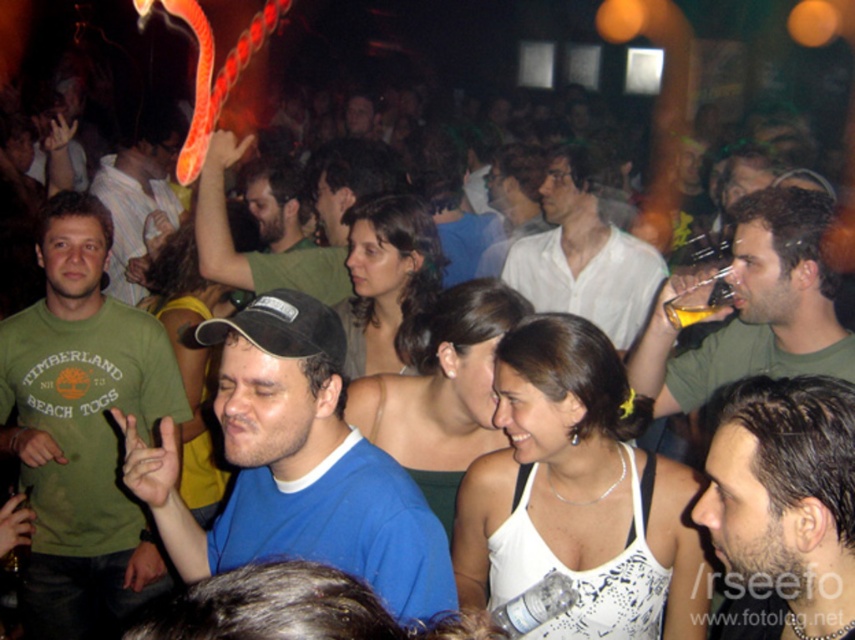
You are a photographer at the nightclub event. You want to take a photo of the green matte shirt at center without any obstructions. Is the translucent yellow glass at upper center blocking your shot?

The green matte shirt at center is below the translucent yellow glass at upper center, so the glass is blocking the shot. You need to adjust your angle or move the glass to capture the shirt without obstruction.

You are at a party and want to get a drink from the bar. You see the green matte shirt at center and the white matte shirt at center in front of you. Which direction should you move to go around them?

Since the green matte shirt at center is positioned on the right side of white matte shirt at center, you should move to the left side of the white matte shirt at center to go around them.